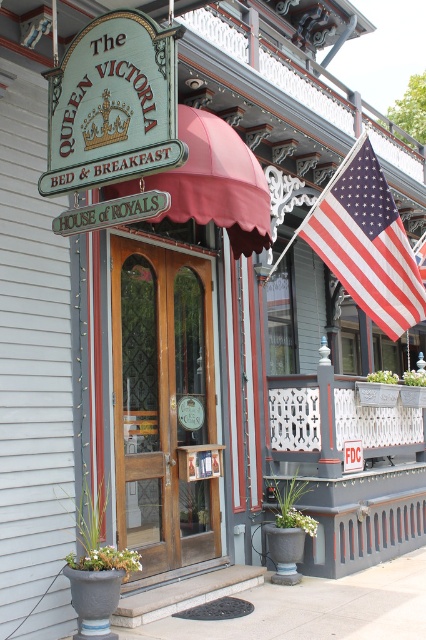
Can you confirm if mahogany wood door at center is bigger than white painted wood porch at lower right?

No, mahogany wood door at center is not bigger than white painted wood porch at lower right.

Who is more distant from viewer, (175, 294) or (319, 381)?

The point (319, 381) is more distant.

Between point (124, 509) and point (301, 388), which one is positioned behind?

Positioned behind is point (301, 388).

Image resolution: width=426 pixels, height=640 pixels. In order to click on mahogany wood door at center in this screenshot , I will do `click(163, 403)`.

Consider the image. Between american flag at upper right and white painted wood porch at lower right, which one is positioned lower?

Positioned lower is white painted wood porch at lower right.

Is american flag at upper right smaller than white painted wood porch at lower right?

Yes, american flag at upper right is smaller than white painted wood porch at lower right.

Is point (403, 275) positioned behind point (293, 458)?

Yes.

The height and width of the screenshot is (640, 426). What are the coordinates of `american flag at upper right` in the screenshot? It's located at (367, 243).

Is green painted wood sign at upper left taller than white painted wood porch at lower right?

In fact, green painted wood sign at upper left may be shorter than white painted wood porch at lower right.

Does green painted wood sign at upper left appear over white painted wood porch at lower right?

Indeed, green painted wood sign at upper left is positioned over white painted wood porch at lower right.

This screenshot has height=640, width=426. What do you see at coordinates (112, 104) in the screenshot? I see `green painted wood sign at upper left` at bounding box center [112, 104].

Image resolution: width=426 pixels, height=640 pixels. What are the coordinates of `green painted wood sign at upper left` in the screenshot? It's located at (112, 104).